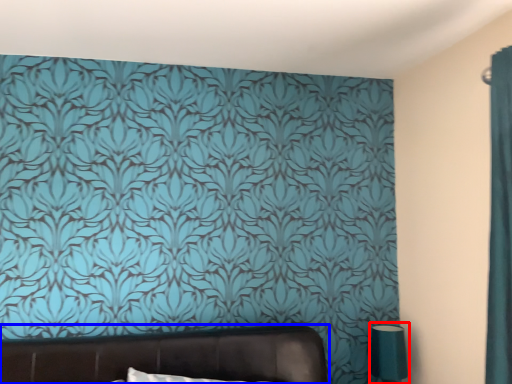
Question: Which of the following is the farthest to the observer, table lamp (highlighted by a red box) or furniture (highlighted by a blue box)?

Choices:
 (A) table lamp
 (B) furniture

Answer: (A)